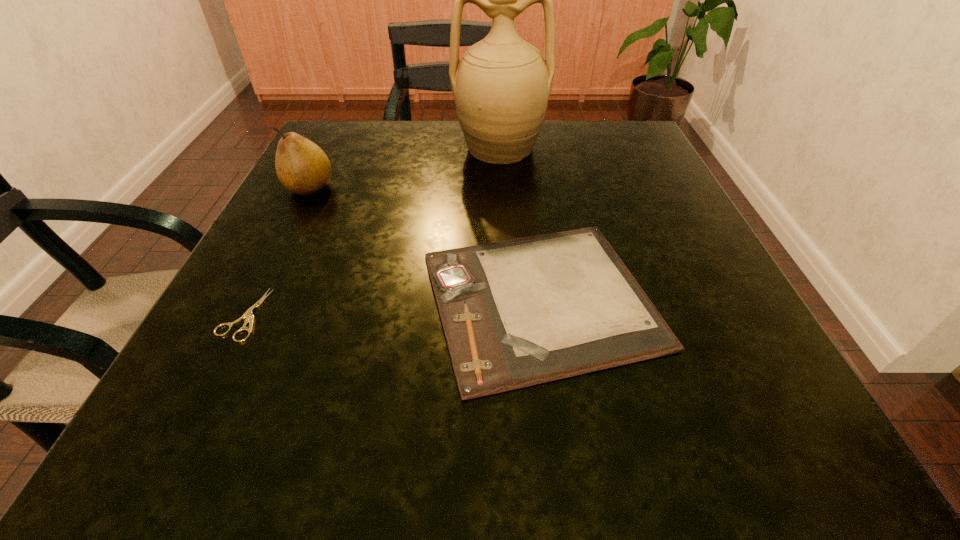
Where is `vacant area that lies between the farthest object and the clipboard`? vacant area that lies between the farthest object and the clipboard is located at coordinates (520, 224).

Identify the location of vacant space that's between the shears and the pear. Image resolution: width=960 pixels, height=540 pixels. (276, 251).

Select which object appears as the closest to the shears. Please provide its 2D coordinates. Your answer should be formatted as a tuple, i.e. [(x, y)], where the tuple contains the x and y coordinates of a point satisfying the conditions above.

[(515, 313)]

Locate which object ranks third in proximity to the tallest object. Please provide its 2D coordinates. Your answer should be formatted as a tuple, i.e. [(x, y)], where the tuple contains the x and y coordinates of a point satisfying the conditions above.

[(248, 314)]

The width and height of the screenshot is (960, 540). Find the location of `free space that satisfies the following two spatial constraints: 1. on the back side of the farthest object; 2. on the left side of the shears`. free space that satisfies the following two spatial constraints: 1. on the back side of the farthest object; 2. on the left side of the shears is located at coordinates (328, 148).

I want to click on vacant region that satisfies the following two spatial constraints: 1. on the back side of the shears; 2. on the left side of the pear, so click(x=308, y=187).